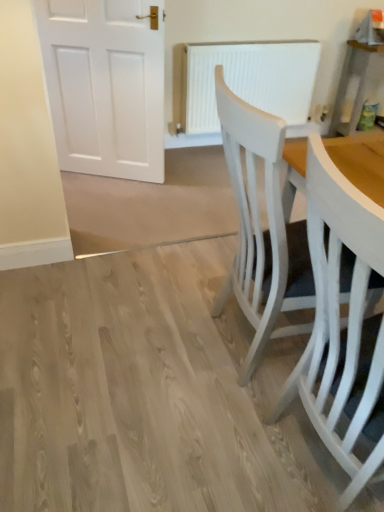
Question: Does white textured radiator at center appear on the left side of white painted wood chair at right, acting as the 2th chair starting from the back?

Choices:
 (A) yes
 (B) no

Answer: (A)

Question: From a real-world perspective, does white textured radiator at center sit lower than white painted wood chair at right, acting as the 2th chair starting from the back?

Choices:
 (A) no
 (B) yes

Answer: (B)

Question: Is white textured radiator at center facing towards white painted wood chair at right, acting as the 2th chair starting from the back?

Choices:
 (A) yes
 (B) no

Answer: (A)

Question: From a real-world perspective, is white textured radiator at center positioned over white painted wood chair at right, acting as the 2th chair starting from the back, based on gravity?

Choices:
 (A) yes
 (B) no

Answer: (B)

Question: Is white textured radiator at center completely or partially outside of white painted wood chair at right, acting as the 2th chair starting from the back?

Choices:
 (A) no
 (B) yes

Answer: (B)

Question: Would you say white painted wood chair at right, which is the first chair in front-to-back order, is inside or outside white textured radiator at center?

Choices:
 (A) inside
 (B) outside

Answer: (B)

Question: From a real-world perspective, is white painted wood chair at right, which is the first chair in front-to-back order, positioned above or below white textured radiator at center?

Choices:
 (A) below
 (B) above

Answer: (B)

Question: In the image, is white painted wood chair at right, acting as the 2th chair starting from the back, positioned in front of or behind white textured radiator at center?

Choices:
 (A) front
 (B) behind

Answer: (A)

Question: Is point (331, 345) closer or farther from the camera than point (231, 54)?

Choices:
 (A) farther
 (B) closer

Answer: (B)

Question: From the image's perspective, is white painted wood chair at right, which ranks as the second chair in front-to-back order, positioned above or below white painted wood chair at right, acting as the 2th chair starting from the back?

Choices:
 (A) above
 (B) below

Answer: (A)

Question: Considering the positions of white painted wood chair at right, which ranks as the second chair in front-to-back order, and white painted wood chair at right, which is the first chair in front-to-back order, in the image, is white painted wood chair at right, which ranks as the second chair in front-to-back order, bigger or smaller than white painted wood chair at right, which is the first chair in front-to-back order,?

Choices:
 (A) small
 (B) big

Answer: (B)

Question: From a real-world perspective, is white painted wood chair at right, which appears as the 1th chair when viewed from the back, positioned above or below white painted wood chair at right, acting as the 2th chair starting from the back?

Choices:
 (A) above
 (B) below

Answer: (A)

Question: Considering their positions, is white painted wood chair at right, which ranks as the second chair in front-to-back order, located in front of or behind white painted wood chair at right, which is the first chair in front-to-back order?

Choices:
 (A) behind
 (B) front

Answer: (A)

Question: Is white textured radiator at center in front of or behind white painted wood chair at right, which appears as the 1th chair when viewed from the back, in the image?

Choices:
 (A) behind
 (B) front

Answer: (A)

Question: From a real-world perspective, is white textured radiator at center above or below white painted wood chair at right, which ranks as the second chair in front-to-back order?

Choices:
 (A) above
 (B) below

Answer: (B)